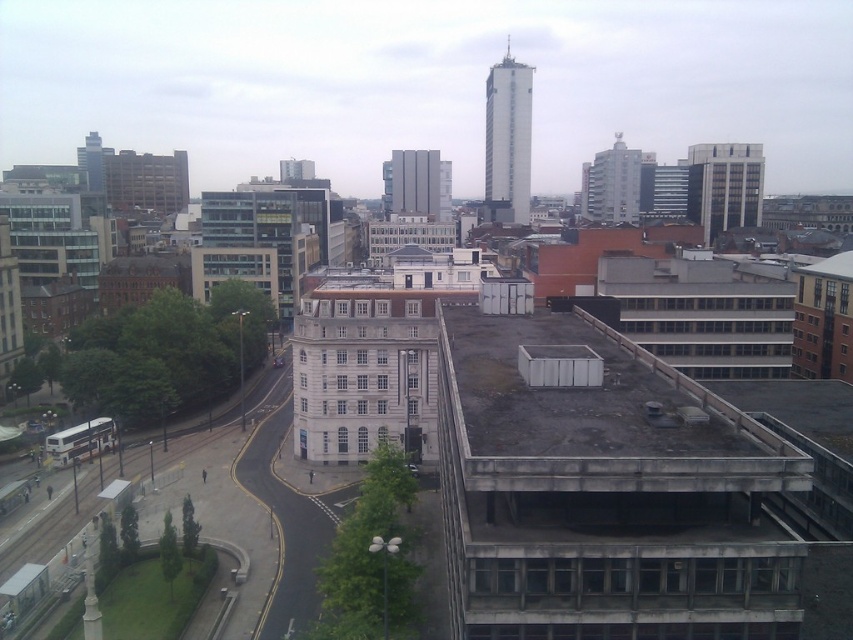
Question: Is white glass building at upper center wider than gray concrete building at center?

Choices:
 (A) no
 (B) yes

Answer: (B)

Question: Which point is farther to the camera?

Choices:
 (A) (94, 152)
 (B) (434, 150)
 (C) (526, 173)

Answer: (C)

Question: Is white glass building at upper center wider than matte glass skyscraper at upper left?

Choices:
 (A) yes
 (B) no

Answer: (B)

Question: Which is farther from the matte glass skyscraper at upper left?

Choices:
 (A) white glass building at upper center
 (B) gray concrete building at center

Answer: (A)

Question: Estimate the real-world distances between objects in this image. Which object is closer to the matte gray building at upper right?

Choices:
 (A) white glass building at upper center
 (B) white smooth tower at upper center
 (C) matte glass skyscraper at upper left
 (D) gray concrete building at center

Answer: (A)

Question: Can you confirm if white glass building at upper center is bigger than matte gray building at upper right?

Choices:
 (A) no
 (B) yes

Answer: (B)